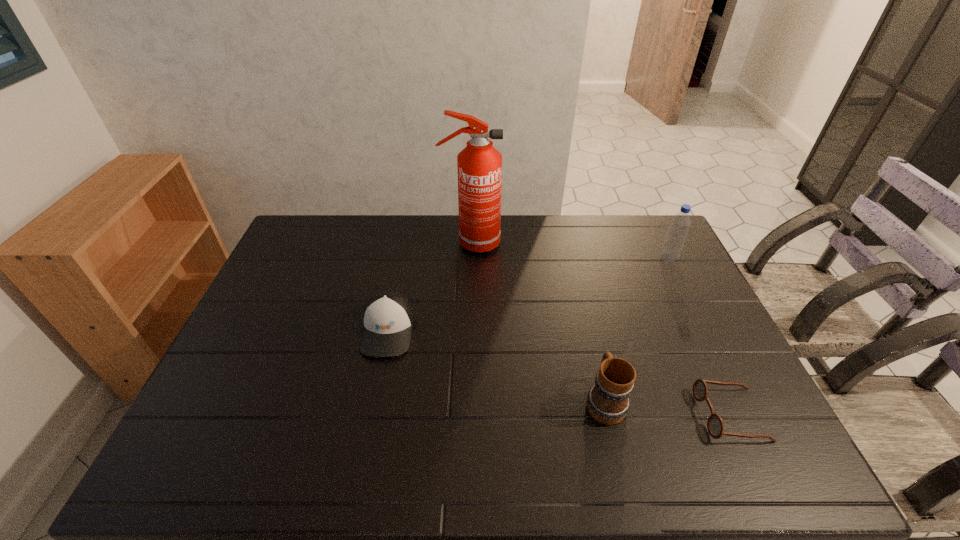
Locate an element on the screen. fire extinguisher is located at coordinates pos(479,164).

Locate an element on the screen. the tallest object is located at coordinates (479, 164).

Image resolution: width=960 pixels, height=540 pixels. Find the location of `the fourth shortest object`. the fourth shortest object is located at coordinates (674, 240).

This screenshot has height=540, width=960. In order to click on the third shortest object in this screenshot , I will do pos(608,401).

At what (x,y) coordinates should I click in order to perform the action: click on mug. Please return your answer as a coordinate pair (x, y). This screenshot has width=960, height=540. Looking at the image, I should click on (608, 401).

Identify the location of the second shortest object. The width and height of the screenshot is (960, 540). (388, 316).

Image resolution: width=960 pixels, height=540 pixels. Find the location of `the third farthest object`. the third farthest object is located at coordinates (388, 316).

This screenshot has width=960, height=540. I want to click on spectacles, so click(715, 425).

Find the location of a particular element. The height and width of the screenshot is (540, 960). free region located 0.350m at the nozzle of the tallest object is located at coordinates (597, 244).

The height and width of the screenshot is (540, 960). Identify the location of vacant space located 0.350m on the left of the bottle. (558, 258).